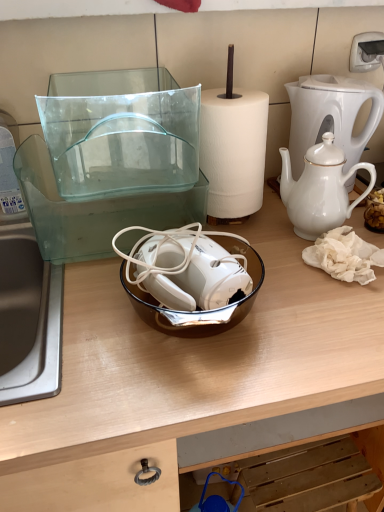
Identify the location of silver metallic sink at left. The image size is (384, 512). (28, 319).

In order to face white porcelain teapot at right, should I rotate leftwards or rightwards?

→ You should look right and rotate roughly 18.059 degrees.

Describe the element at coordinates (184, 376) in the screenshot. I see `transparent glass bowl at center` at that location.

What are the coordinates of `white glossy jar at right` in the screenshot? It's located at (375, 210).

Is point (302, 158) closer or farther from the camera than point (89, 330)?

Point (302, 158) is positioned farther from the camera compared to point (89, 330).

From a real-world perspective, is white glossy coffee maker at upper right on transparent glass bowl at center?

Yes.

Is white glossy coffee maker at upper right next to transparent glass bowl at center and touching it?

white glossy coffee maker at upper right is not next to transparent glass bowl at center, and they're not touching.

Is silver metallic sink at left completely or partially inside white glossy jar at right?

No, silver metallic sink at left is not surrounded by white glossy jar at right.

From the image's perspective, does white glossy jar at right appear higher than silver metallic sink at left?

Correct, white glossy jar at right appears higher than silver metallic sink at left in the image.

Can you confirm if white glossy jar at right is wider than silver metallic sink at left?

Incorrect, the width of white glossy jar at right does not surpass that of silver metallic sink at left.

Where is `food that is on the right side of silver metallic sink at left`? The width and height of the screenshot is (384, 512). food that is on the right side of silver metallic sink at left is located at coordinates (375, 210).

Which is nearer, (375, 195) or (268, 198)?

The point (375, 195) is closer to the camera.

Which of these two, white glossy jar at right or transparent glass bowl at center, is bigger?

transparent glass bowl at center is bigger.

Is white glossy jar at right turned away from transparent glass bowl at center?

No, transparent glass bowl at center is not at the back of white glossy jar at right.

Is white glossy jar at right inside the boundaries of transparent glass bowl at center, or outside?

white glossy jar at right cannot be found inside transparent glass bowl at center.

Locate an element on the screen. food below the white porcelain teapot at right (from the image's perspective) is located at coordinates (375, 210).

What's the angular difference between white glossy jar at right and white porcelain teapot at right's facing directions?

2.45 degrees separate the facing orientations of white glossy jar at right and white porcelain teapot at right.

Which object is wider, white glossy jar at right or white porcelain teapot at right?

white porcelain teapot at right.

Does white glossy jar at right have a larger size compared to white porcelain teapot at right?

Actually, white glossy jar at right might be smaller than white porcelain teapot at right.

Is brown glass bowl at center beside white porcelain teapot at right?

No, brown glass bowl at center is not touching white porcelain teapot at right.

From the image's perspective, is brown glass bowl at center located above white porcelain teapot at right?

No, from the image's perspective, brown glass bowl at center is not on top of white porcelain teapot at right.

Is brown glass bowl at center shorter than white porcelain teapot at right?

Yes.

Can you confirm if white glossy coffee maker at upper right is bigger than brown glass bowl at center?

Yes.

Is white glossy coffee maker at upper right facing towards brown glass bowl at center?

No.

Considering the sizes of objects white glossy coffee maker at upper right and brown glass bowl at center in the image provided, who is taller, white glossy coffee maker at upper right or brown glass bowl at center?

Standing taller between the two is white glossy coffee maker at upper right.

Can you confirm if silver metallic sink at left is positioned to the right of white glossy jar at right?

No, silver metallic sink at left is not to the right of white glossy jar at right.

Does point (30, 260) come in front of point (380, 229)?

No, (30, 260) is further to viewer.

Is silver metallic sink at left far from white glossy jar at right?

No, silver metallic sink at left is not far away from white glossy jar at right.

Looking at this image, which object is closer to the camera, silver metallic sink at left or white glossy jar at right?

Positioned in front is silver metallic sink at left.

What are the coordinates of `table that appears in front of the white glossy coffee maker at upper right` in the screenshot? It's located at (184, 376).

There is a silver metallic sink at left. Where is `food above it (from a real-world perspective)`? This screenshot has width=384, height=512. food above it (from a real-world perspective) is located at coordinates (375, 210).

From the image, which object appears to be farther from white porcelain teapot at right, white glossy coffee maker at upper right or brown glass bowl at center?

The object further to white porcelain teapot at right is brown glass bowl at center.

From the image, which object appears to be nearer to silver metallic sink at left, white glossy coffee maker at upper right or brown glass bowl at center?

brown glass bowl at center is positioned closer to the anchor silver metallic sink at left.

Which object lies nearer to the anchor point silver metallic sink at left, white glossy jar at right or transparent glass bowl at center?

Based on the image, transparent glass bowl at center appears to be nearer to silver metallic sink at left.

Looking at the image, which one is located further to white glossy jar at right, brown glass bowl at center or transparent glass bowl at center?

Based on the image, transparent glass bowl at center appears to be further to white glossy jar at right.

Estimate the real-world distances between objects in this image. Which object is closer to transparent glass bowl at center, white glossy coffee maker at upper right or brown glass bowl at center?

The object closer to transparent glass bowl at center is brown glass bowl at center.

Which object lies further to the anchor point silver metallic sink at left, white porcelain teapot at right or white glossy jar at right?

Based on the image, white glossy jar at right appears to be further to silver metallic sink at left.

Looking at the image, which one is located closer to transparent glass bowl at center, white porcelain teapot at right or white glossy jar at right?

white porcelain teapot at right.

Considering their positions, is white glossy coffee maker at upper right positioned further to white glossy jar at right than brown glass bowl at center?

Based on the image, brown glass bowl at center appears to be further to white glossy jar at right.

Locate an element on the screen. bowl between silver metallic sink at left and white glossy coffee maker at upper right from left to right is located at coordinates (198, 310).

I want to click on table between silver metallic sink at left and white porcelain teapot at right from left to right, so tap(184, 376).

Locate an element on the screen. Image resolution: width=384 pixels, height=512 pixels. teapot between white glossy coffee maker at upper right and white glossy jar at right in the up-down direction is located at coordinates (320, 189).

Identify the location of teapot between white glossy coffee maker at upper right and transparent glass bowl at center from top to bottom. (320, 189).